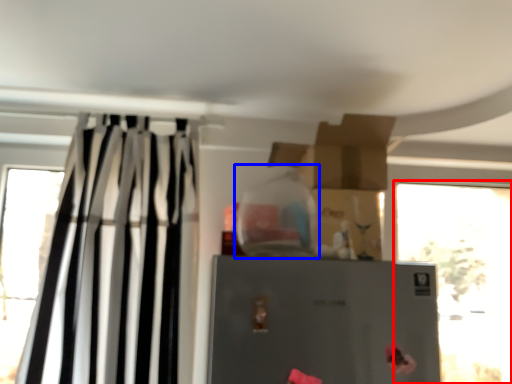
Question: Which point is closer to the camera, window (highlighted by a red box) or bottle (highlighted by a blue box)?

Choices:
 (A) window
 (B) bottle

Answer: (B)